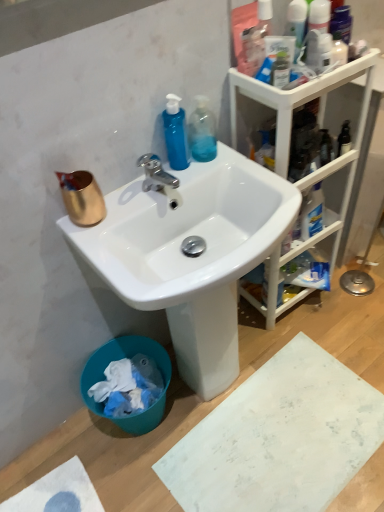
You are a GUI agent. You are given a task and a screenshot of the screen. Output one action in this format:
    pyautogui.click(x=<x>, y=<y>)
    Task: Click on the vacant space in front of transparent plastic bottle at upper center, placed as the 1th cleaning product when sorted from right to left
    
    Given the screenshot: What is the action you would take?
    (201, 175)